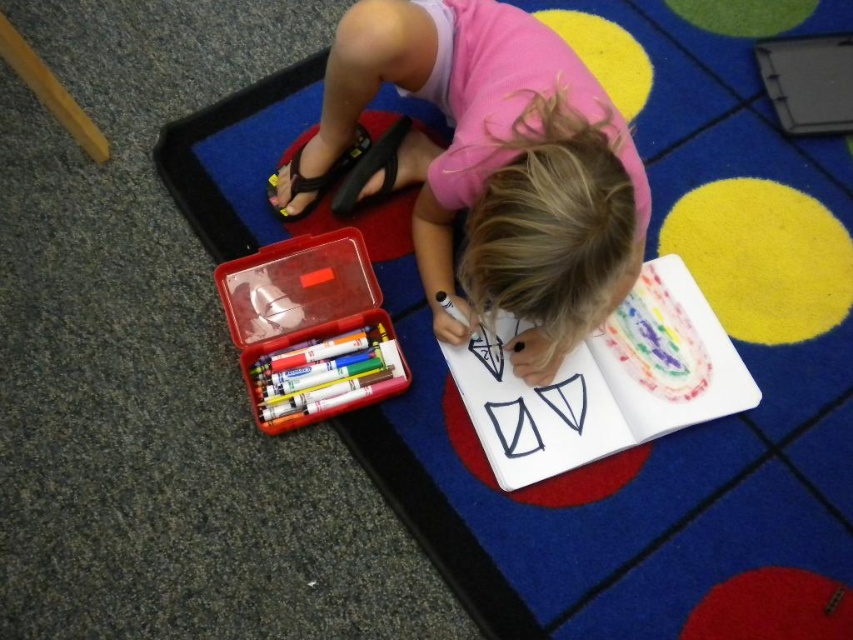
Is pink fabric child at center positioned at the back of translucent plastic container at lower left?

That is False.

Does pink fabric child at center have a lesser height compared to translucent plastic container at lower left?

Incorrect, pink fabric child at center's height does not fall short of translucent plastic container at lower left's.

Which is behind, point (329, 99) or point (245, 340)?

Point (329, 99)

You are a GUI agent. You are given a task and a screenshot of the screen. Output one action in this format:
    pyautogui.click(x=<x>, y=<y>)
    Task: Click on the pink fabric child at center
    The width and height of the screenshot is (853, 640).
    Given the screenshot: What is the action you would take?
    pyautogui.click(x=494, y=164)